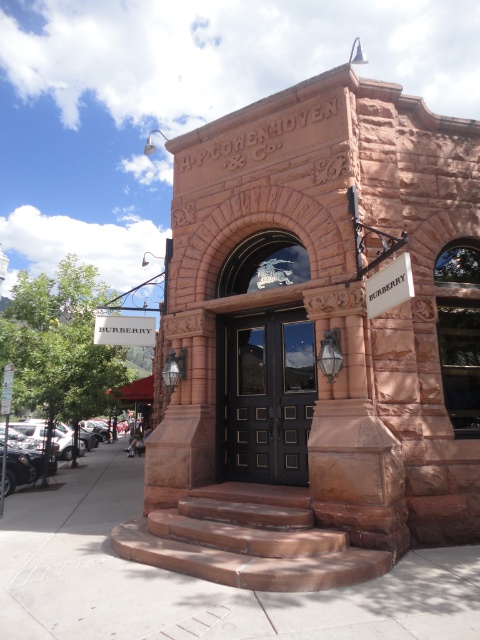
You are standing at the entrance of the historic building and see two points marked on the ground. The first point is at coordinate point (420, 577) and the second is at point (4, 492). If you want to walk towards the point that is closer to you, which coordinate should you head towards?

You should head towards point (420, 577) because it is in front of point (4, 492), meaning it is closer to your current position at the entrance.

You are standing on the smooth concrete pavement at center. Looking towards the historic building, where is the entrance located relative to your position?

The entrance is located above the smooth concrete pavement at center, as the steps lead up to it.

You are standing at the bottom of the brown stone stairs at center. Looking up, where would you see the entrance doors in relation to your position?

The entrance doors are above the brown stone stairs at center since the stairs lead up to the entrance.